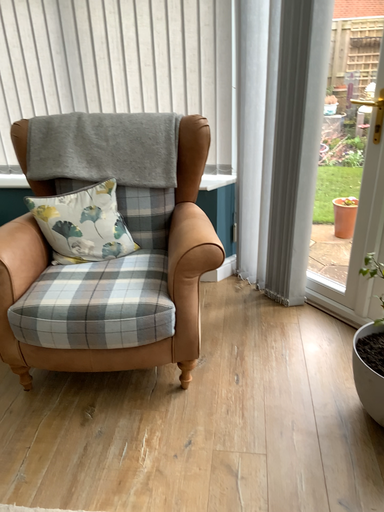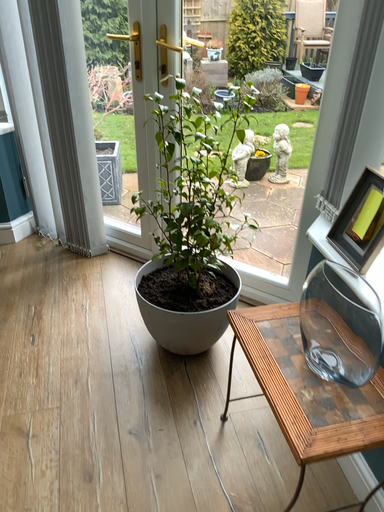
Question: Which way did the camera rotate in the video?

Choices:
 (A) rotated right
 (B) rotated left

Answer: (A)